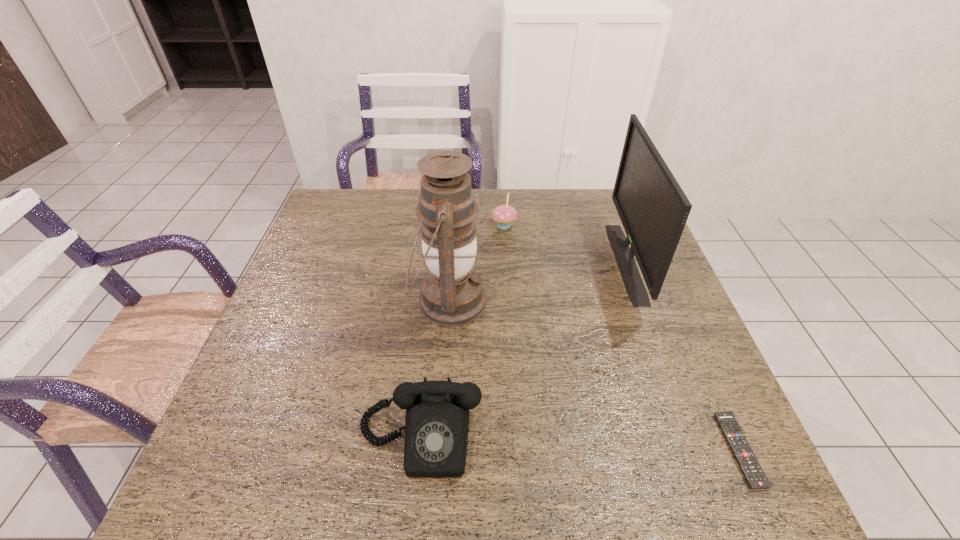
Where is `the tallest object`? the tallest object is located at coordinates (452, 294).

You are a GUI agent. You are given a task and a screenshot of the screen. Output one action in this format:
    pyautogui.click(x=<x>, y=<y>)
    Task: Click on the second tallest object
    This screenshot has height=540, width=960.
    Given the screenshot: What is the action you would take?
    pyautogui.click(x=653, y=208)

Locate an element on the screen. The image size is (960, 540). the second object from right to left is located at coordinates point(653,208).

This screenshot has height=540, width=960. Identify the location of cupcake. (504, 215).

Where is `telephone`? The height and width of the screenshot is (540, 960). telephone is located at coordinates (436, 427).

In order to click on the shortest object in this screenshot , I will do `click(745, 457)`.

The image size is (960, 540). Find the location of `the rightmost object`. the rightmost object is located at coordinates coord(745,457).

The image size is (960, 540). I want to click on vacant space located 0.290m on the right of the tallest object, so click(x=598, y=301).

The width and height of the screenshot is (960, 540). Find the location of `vacant space located on the front-facing side of the monitor`. vacant space located on the front-facing side of the monitor is located at coordinates tap(599, 262).

Find the location of a particular element. The width and height of the screenshot is (960, 540). free space located 0.190m on the front-facing side of the monitor is located at coordinates coord(550,262).